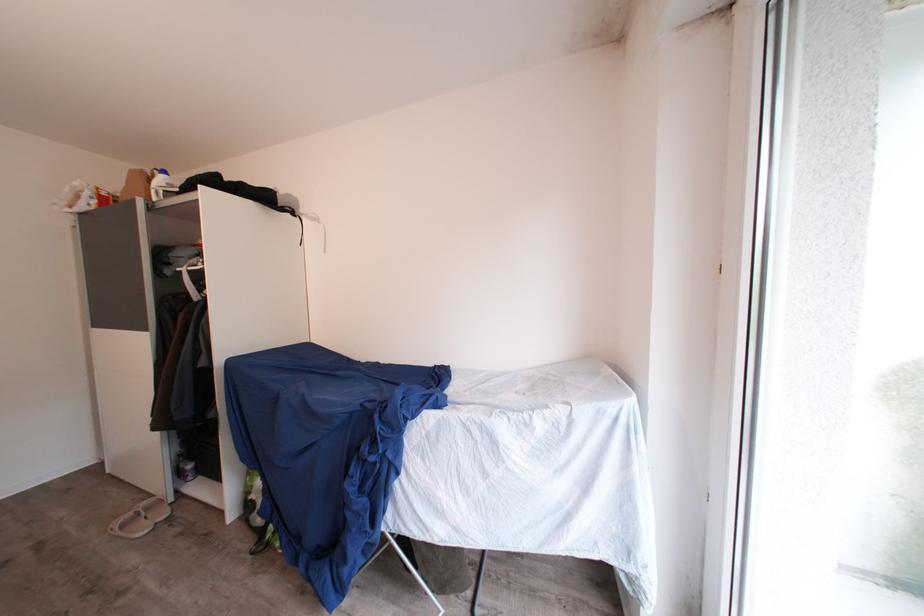
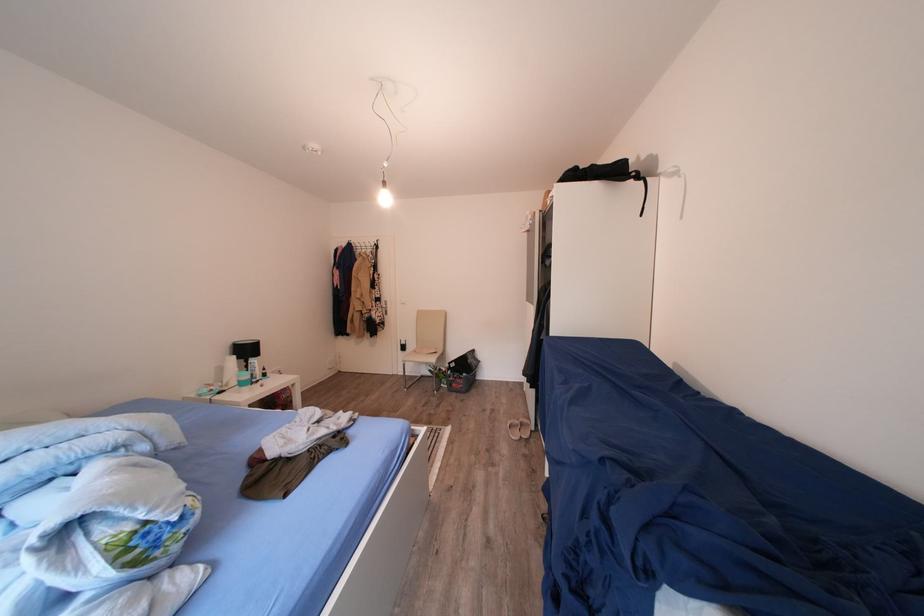
Find the pixel in the second image that matches (138,521) in the first image.

(526, 427)